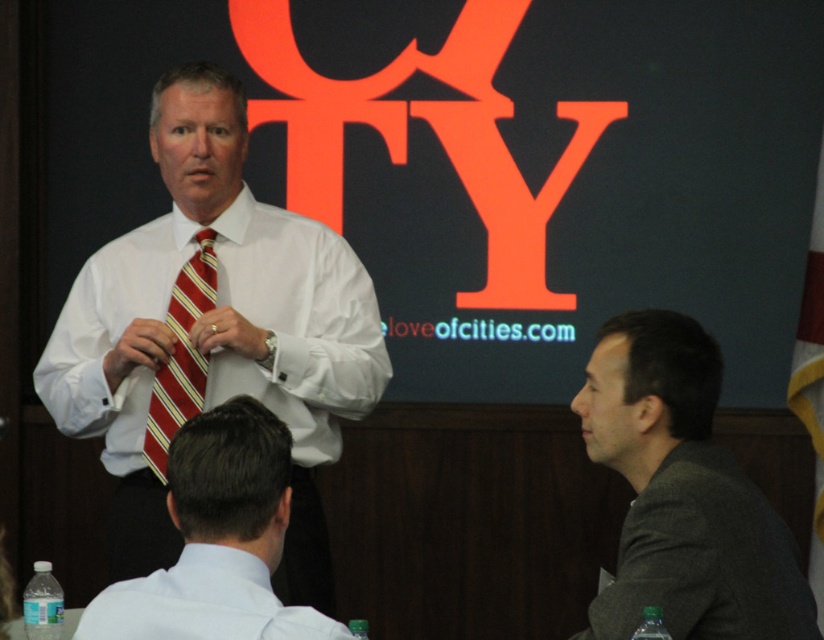
You are an event planner setting up the presentation room. You need to ensure the red striped tie at center is visible to the audience without being obscured by the matte orange projection screen at upper center. Based on their sizes, can you confirm if this is possible?

The matte orange projection screen at upper center is larger in size than the red striped tie at center. Since the screen is larger, it may partially or fully block the view of the red striped tie at center depending on their positions. However, the description does not provide information about their spatial arrangement beyond size. To ensure visibility, adjust the speaker or screen position so the tie remains outside the screen area.

Where is the white smooth shirt at center located in the image?

The white smooth shirt at center is located at point 0.506 on the x axis and 0.362 on the y axis.